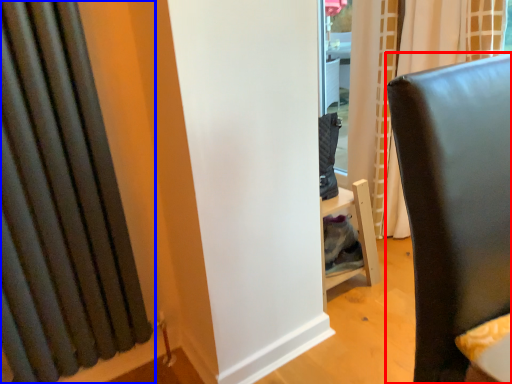
Question: Which point is closer to the camera, furniture (highlighted by a red box) or curtain (highlighted by a blue box)?

Choices:
 (A) furniture
 (B) curtain

Answer: (A)